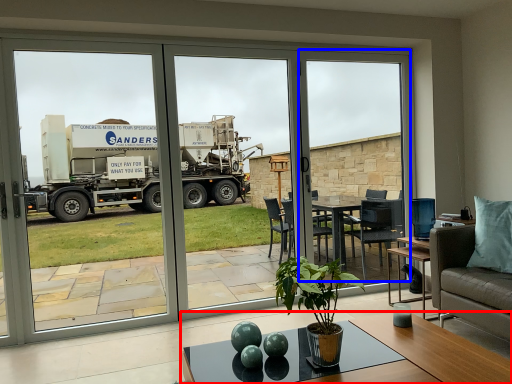
Question: Which point is further to the camera, coffee table (highlighted by a red box) or window screen (highlighted by a blue box)?

Choices:
 (A) coffee table
 (B) window screen

Answer: (B)